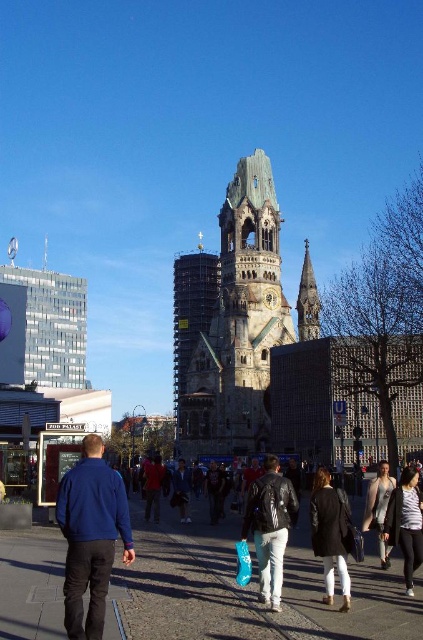
You are a photographer standing in the foreground of the urban scene. You want to capture a clear photo of the red leather jacket at center without the smooth stone spire at center blocking it. Is this possible given their positions?

The red leather jacket at center is behind the smooth stone spire at center, so it would be blocked from view. To capture a clear photo of the red leather jacket at center without the spire blocking it, you would need to adjust your position to find an angle where the spire no longer obscures the jacket.

You are a photographer standing in the middle of the paved area. You want to take a photo of both the dark brown stone tower at center and the black leather jacket at center. Which object should you zoom in on first to ensure both fit in the frame?

The dark brown stone tower at center is wider than the black leather jacket at center, so you should zoom out first to capture the wider dark brown stone tower at center before adjusting to include the black leather jacket at center.